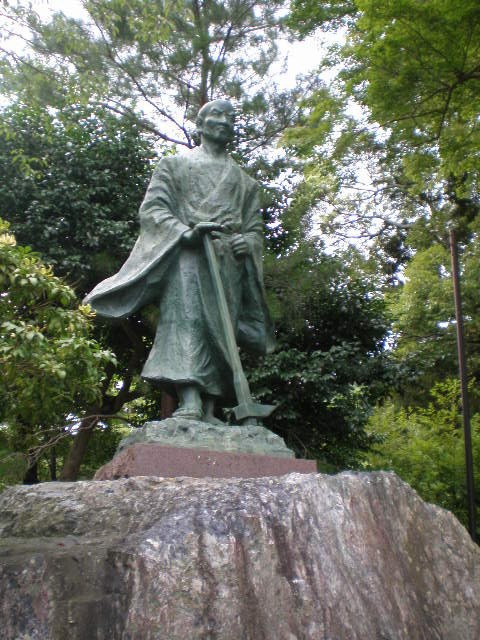
This screenshot has width=480, height=640. Find the location of ``robe`. `robe is located at coordinates pyautogui.click(x=188, y=346).